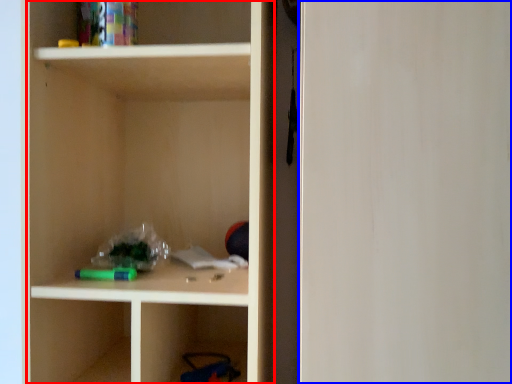
Question: Which object is closer to the camera taking this photo, cabinetry (highlighted by a red box) or glass door (highlighted by a blue box)?

Choices:
 (A) cabinetry
 (B) glass door

Answer: (B)